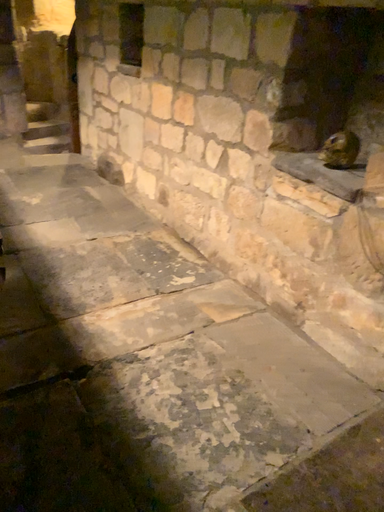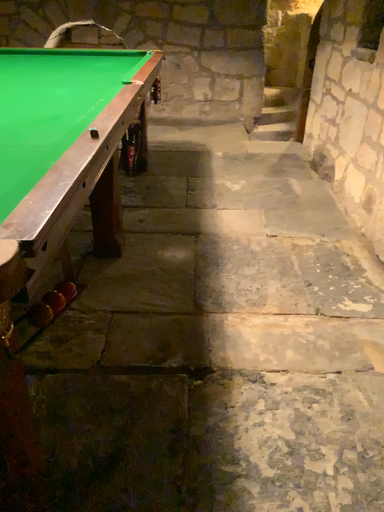
Question: How did the camera likely rotate when shooting the video?

Choices:
 (A) rotated right
 (B) rotated left

Answer: (B)